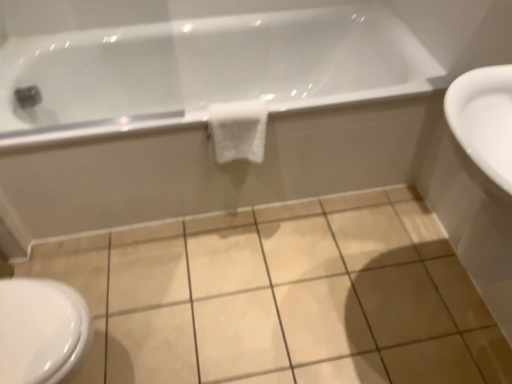
This screenshot has width=512, height=384. What do you see at coordinates (281, 297) in the screenshot? I see `beige ceramic tile at center` at bounding box center [281, 297].

The width and height of the screenshot is (512, 384). What do you see at coordinates (481, 183) in the screenshot?
I see `white glossy sink at right` at bounding box center [481, 183].

Image resolution: width=512 pixels, height=384 pixels. What do you see at coordinates (238, 130) in the screenshot? I see `white soft towel at center` at bounding box center [238, 130].

The width and height of the screenshot is (512, 384). I want to click on beige ceramic tile at center, so pyautogui.click(x=281, y=297).

Is white glossy bidet at lower left not close to beige ceramic tile at center?

No, there isn't a large distance between white glossy bidet at lower left and beige ceramic tile at center.

Is white glossy bidet at lower left to the left or to the right of beige ceramic tile at center in the image?

In the image, white glossy bidet at lower left appears on the left side of beige ceramic tile at center.

Does white glossy bidet at lower left have a smaller size compared to beige ceramic tile at center?

No, white glossy bidet at lower left is not smaller than beige ceramic tile at center.

From the picture: Can you confirm if white soft towel at center is smaller than white glossy bidet at lower left?

Indeed, white soft towel at center has a smaller size compared to white glossy bidet at lower left.

Is point (243, 126) positioned behind point (80, 312)?

Yes, it is behind point (80, 312).

Where is `bidet above the white glossy bathtub at upper center (from a real-world perspective)`? This screenshot has width=512, height=384. bidet above the white glossy bathtub at upper center (from a real-world perspective) is located at coordinates (41, 330).

Looking at this image, from the image's perspective, who appears lower, white glossy bathtub at upper center or white glossy bidet at lower left?

white glossy bidet at lower left, from the image's perspective.

How far apart are white glossy bathtub at upper center and white glossy bidet at lower left?

white glossy bathtub at upper center and white glossy bidet at lower left are 35.87 inches apart.

Considering the sizes of objects white glossy bathtub at upper center and white glossy bidet at lower left in the image provided, who is smaller, white glossy bathtub at upper center or white glossy bidet at lower left?

Smaller between the two is white glossy bidet at lower left.

From a real-world perspective, does white glossy bidet at lower left stand above white glossy sink at right?

No, from a real-world perspective, white glossy bidet at lower left is not above white glossy sink at right.

Considering the sizes of objects white glossy bidet at lower left and white glossy sink at right in the image provided, who is bigger, white glossy bidet at lower left or white glossy sink at right?

With larger size is white glossy sink at right.

From the picture: Can you confirm if white glossy bidet at lower left is shorter than white glossy sink at right?

Indeed, white glossy bidet at lower left has a lesser height compared to white glossy sink at right.

Does white glossy bidet at lower left come behind white glossy sink at right?

Yes, white glossy bidet at lower left is further from the camera.

Would you consider white glossy sink at right to be distant from white soft towel at center?

That's not correct — white glossy sink at right is a little close to white soft towel at center.

Visually, is white glossy sink at right positioned to the left or to the right of white soft towel at center?

white glossy sink at right is to the right of white soft towel at center.

Is white glossy sink at right spatially inside white soft towel at center, or outside of it?

white glossy sink at right is not enclosed by white soft towel at center.

From a real-world perspective, which is physically below, white glossy sink at right or white soft towel at center?

white soft towel at center is physically lower.

Looking at this image, is the depth of white glossy bidet at lower left less than that of white soft towel at center?

Yes, white glossy bidet at lower left is closer to the viewer.

Visually, is white glossy bidet at lower left positioned to the left or to the right of white soft towel at center?

From the image, it's evident that white glossy bidet at lower left is to the left of white soft towel at center.

Based on their sizes in the image, would you say white glossy bidet at lower left is bigger or smaller than white soft towel at center?

Clearly, white glossy bidet at lower left is larger in size than white soft towel at center.

From the image's perspective, who appears lower, white glossy bidet at lower left or white soft towel at center?

white glossy bidet at lower left.

Considering the sizes of objects white glossy sink at right and white glossy bathtub at upper center in the image provided, who is bigger, white glossy sink at right or white glossy bathtub at upper center?

With larger size is white glossy bathtub at upper center.

Which object is wider, white glossy sink at right or white glossy bathtub at upper center?

With larger width is white glossy bathtub at upper center.

Which object is positioned more to the right, white glossy sink at right or white glossy bathtub at upper center?

white glossy sink at right is more to the right.

In the scene shown: Does white glossy sink at right lie in front of white glossy bathtub at upper center?

Yes, the depth of white glossy sink at right is less than that of white glossy bathtub at upper center.

I want to click on bidet in front of the beige ceramic tile at center, so click(x=41, y=330).

At what (x,y) coordinates should I click in order to perform the action: click on bidet lying below the white soft towel at center (from the image's perspective). Please return your answer as a coordinate pair (x, y). Looking at the image, I should click on (41, 330).

Estimate the real-world distances between objects in this image. Which object is closer to white glossy bidet at lower left, white glossy bathtub at upper center or white glossy sink at right?

white glossy bathtub at upper center lies closer to white glossy bidet at lower left than the other object.

Based on their spatial positions, is white glossy bidet at lower left or beige ceramic tile at center closer to white glossy bathtub at upper center?

beige ceramic tile at center is closer to white glossy bathtub at upper center.

When comparing their distances from white glossy sink at right, does beige ceramic tile at center or white glossy bidet at lower left seem further?

Based on the image, white glossy bidet at lower left appears to be further to white glossy sink at right.

From the image, which object appears to be farther from white glossy bidet at lower left, white soft towel at center or white glossy sink at right?

white glossy sink at right is positioned further to the anchor white glossy bidet at lower left.

Based on their spatial positions, is white glossy bathtub at upper center or white glossy sink at right closer to white soft towel at center?

white glossy bathtub at upper center is closer to white soft towel at center.

Looking at the image, which one is located closer to white glossy sink at right, white soft towel at center or beige ceramic tile at center?

Based on the image, beige ceramic tile at center appears to be nearer to white glossy sink at right.

Which object lies nearer to the anchor point white soft towel at center, white glossy bidet at lower left or white glossy sink at right?

The object closer to white soft towel at center is white glossy sink at right.

Looking at the image, which one is located further to beige ceramic tile at center, white soft towel at center or white glossy bidet at lower left?

white glossy bidet at lower left.

Locate an element on the screen. The image size is (512, 384). bath towel between white glossy bathtub at upper center and white glossy bidet at lower left vertically is located at coordinates (238, 130).

At what (x,y) coordinates should I click in order to perform the action: click on ceramic tile that lies between white glossy bathtub at upper center and white glossy bidet at lower left from top to bottom. Please return your answer as a coordinate pair (x, y). Looking at the image, I should click on (281, 297).

The image size is (512, 384). In order to click on ceramic tile located between white glossy bathtub at upper center and white glossy sink at right in the left-right direction in this screenshot , I will do `click(281, 297)`.

Locate an element on the screen. The height and width of the screenshot is (384, 512). bathtub between white glossy bidet at lower left and white glossy sink at right from left to right is located at coordinates (207, 113).